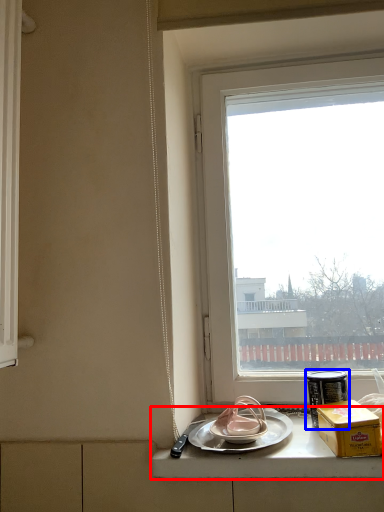
Question: Which object appears closest to the camera in this image, counter top (highlighted by a red box) or tableware (highlighted by a blue box)?

Choices:
 (A) counter top
 (B) tableware

Answer: (A)